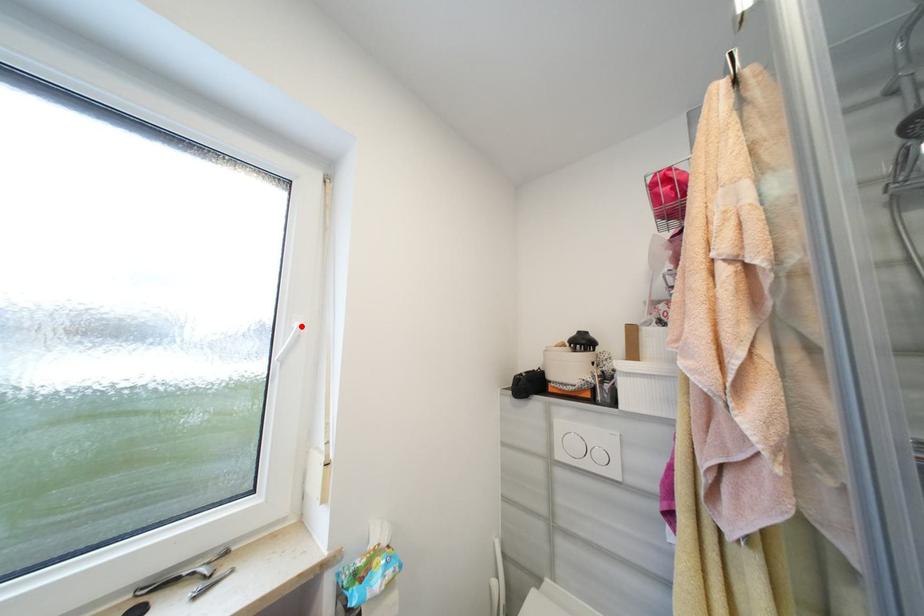
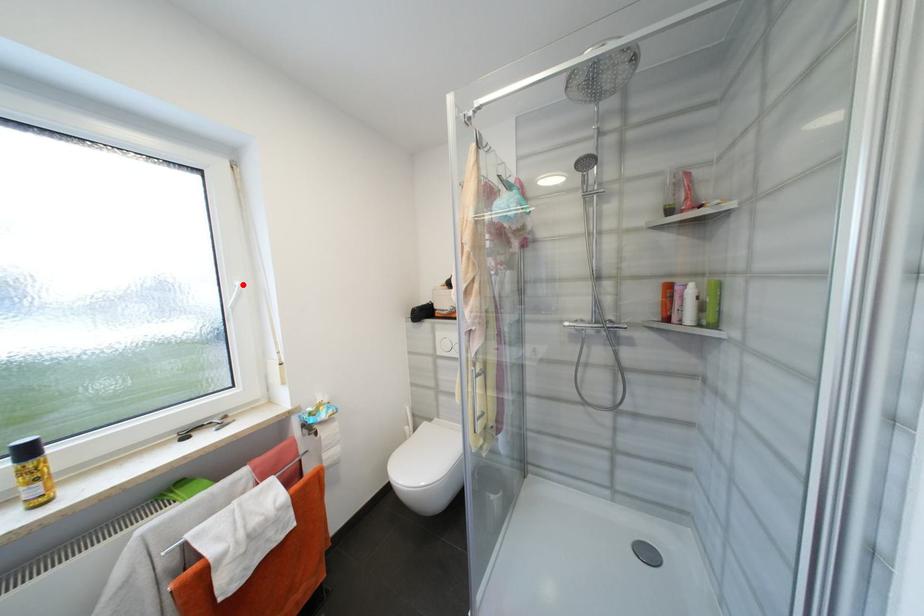
I am providing you with two images of the same scene from different viewpoints. A red point is marked on the first image and another point is marked on the second image. Are the points marked in image1 and image2 representing the same 3D position?

Yes